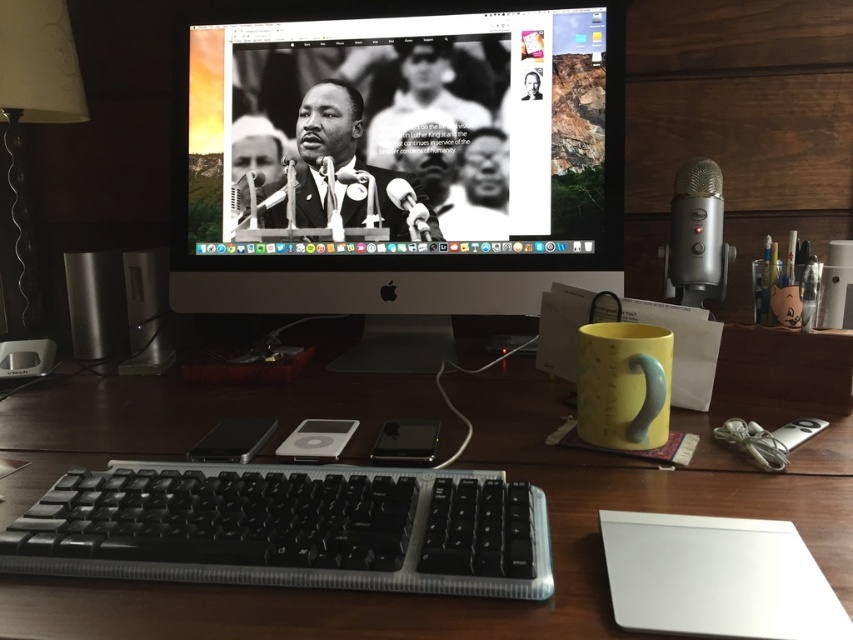
Looking at this image, is matte silver lamp at left to the right of silver metallic speaker at left from the viewer's perspective?

No, matte silver lamp at left is not to the right of silver metallic speaker at left.

Is matte silver lamp at left wider than silver metallic speaker at left?

Correct, the width of matte silver lamp at left exceeds that of silver metallic speaker at left.

This screenshot has width=853, height=640. What do you see at coordinates (33, 108) in the screenshot?
I see `matte silver lamp at left` at bounding box center [33, 108].

Image resolution: width=853 pixels, height=640 pixels. I want to click on matte silver lamp at left, so click(x=33, y=108).

Does black matte monitor at center appear under black plastic keyboard at lower left?

Incorrect, black matte monitor at center is not positioned below black plastic keyboard at lower left.

Does black matte monitor at center lie behind black plastic keyboard at lower left?

Yes, black matte monitor at center is further from the viewer.

Does point (267, 60) come farther from viewer compared to point (358, 582)?

Yes, it is behind point (358, 582).

The width and height of the screenshot is (853, 640). I want to click on black matte monitor at center, so click(x=410, y=120).

Between wooden at center and black matte monitor at center, which one appears on the right side from the viewer's perspective?

black matte monitor at center is more to the right.

Is wooden at center below black matte monitor at center?

Yes, wooden at center is below black matte monitor at center.

Find the location of a particular element. wooden at center is located at coordinates 547,513.